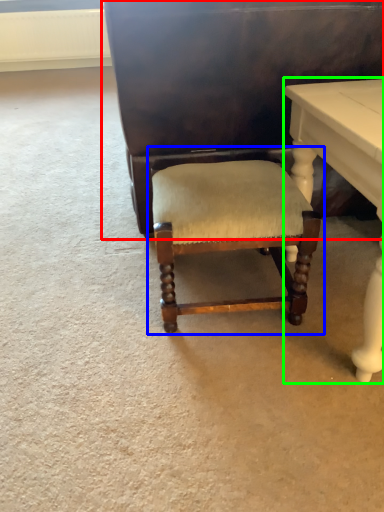
Question: Which object is the closest to the vanity (highlighted by a red box)? Choose among these: chair (highlighted by a blue box) or table (highlighted by a green box).

Choices:
 (A) chair
 (B) table

Answer: (B)